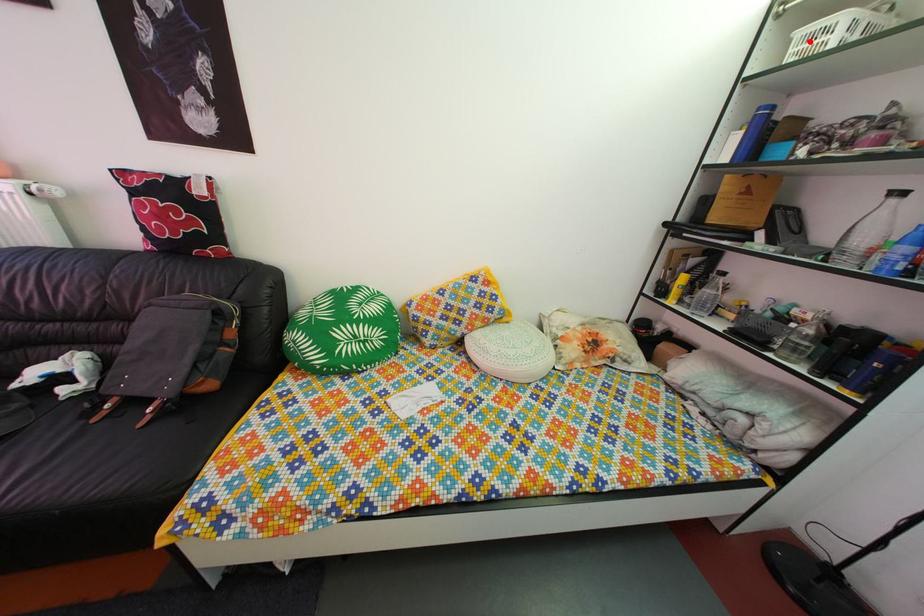
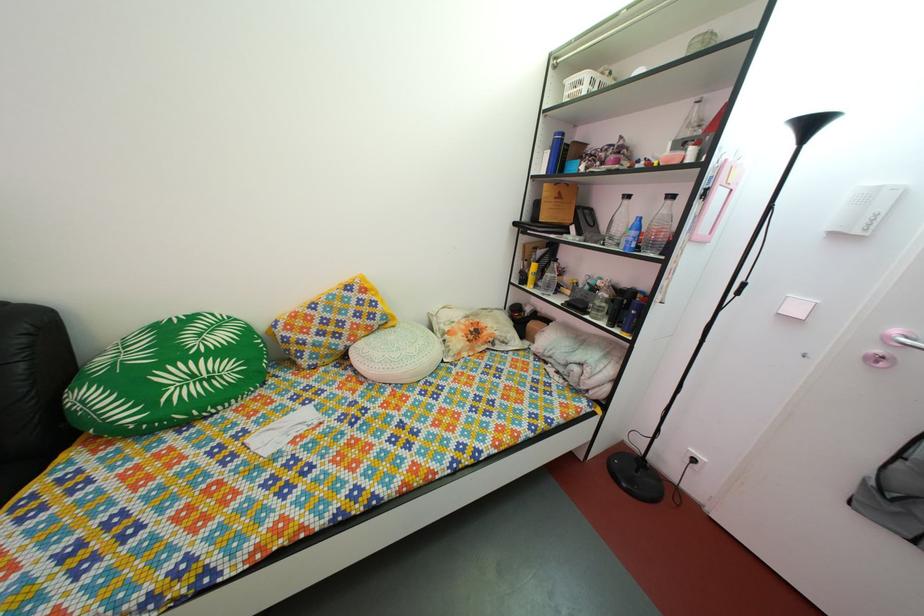
In the second image, find the point that corresponds to the highlighted location in the first image.

(578, 91)